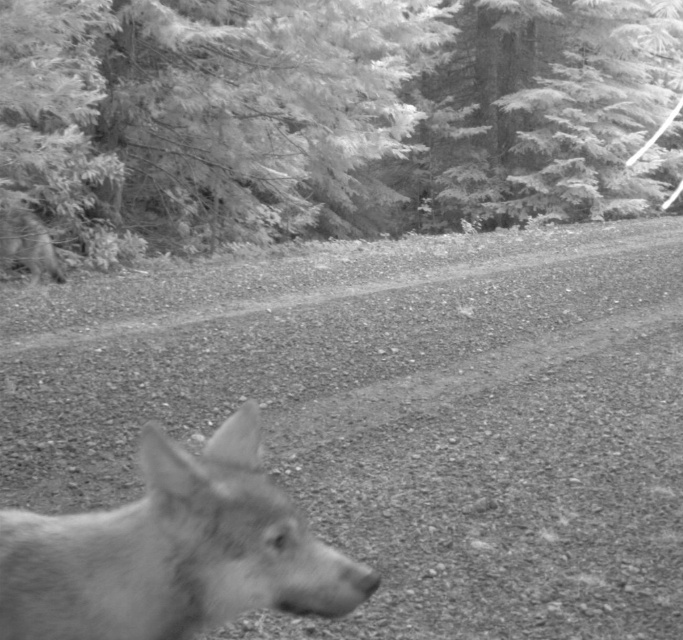
Question: Can you confirm if gravelly dirt track at center is wider than fuzzy fur dog at left?

Choices:
 (A) no
 (B) yes

Answer: (B)

Question: Is coarse textured evergreen tree at upper center positioned at the back of fuzzy fur dog at left?

Choices:
 (A) yes
 (B) no

Answer: (B)

Question: Does fuzzy fur dog at lower left have a greater width compared to fuzzy fur dog at left?

Choices:
 (A) no
 (B) yes

Answer: (A)

Question: Which is nearer to the coarse textured evergreen tree at upper center?

Choices:
 (A) fuzzy fur dog at left
 (B) gravelly dirt track at center

Answer: (A)

Question: Which point is closer to the camera?

Choices:
 (A) coarse textured evergreen tree at upper center
 (B) fuzzy fur dog at left
 (C) gravelly dirt track at center
 (D) fuzzy fur dog at lower left

Answer: (D)

Question: Among these objects, which one is farthest from the camera?

Choices:
 (A) fuzzy fur dog at lower left
 (B) gravelly dirt track at center
 (C) coarse textured evergreen tree at upper center

Answer: (C)